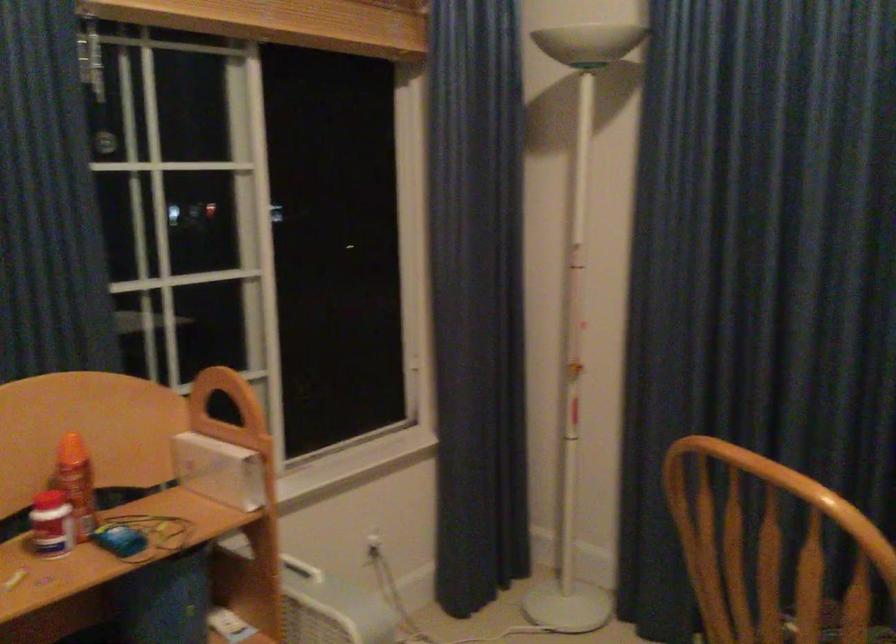
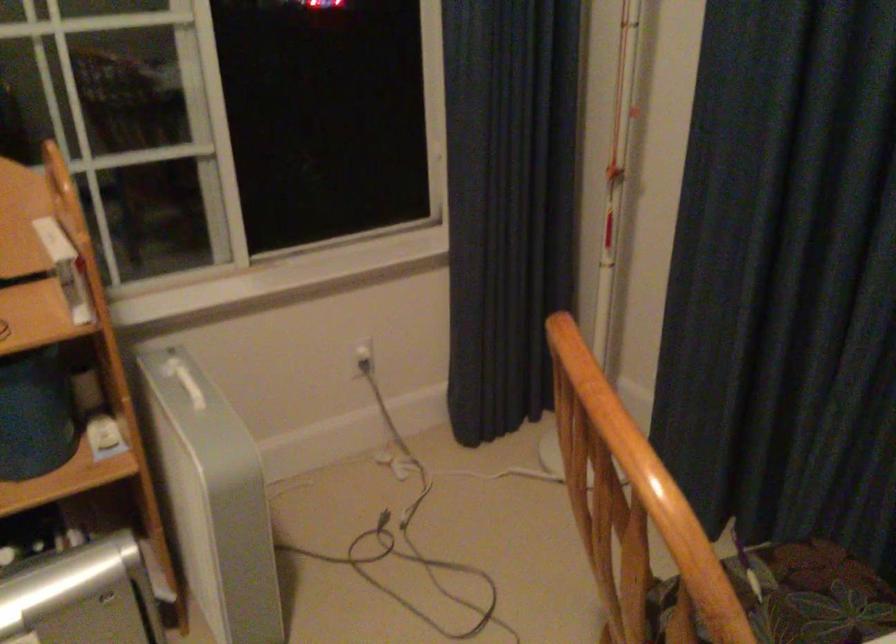
First-person continuous shooting, in which direction is the camera rotating?

The camera rotated toward left-down.